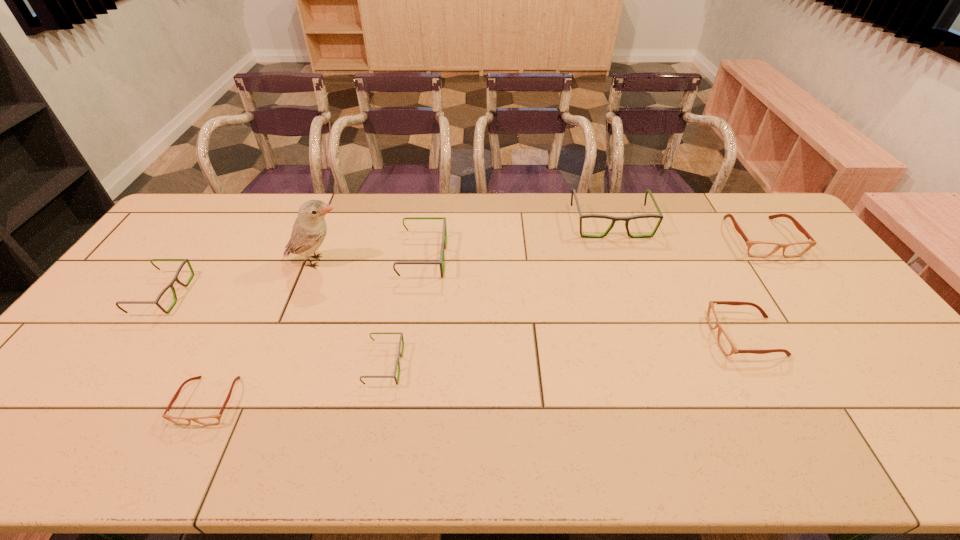
Select which brown spectacles appears as the third closest to the tallest spectacles. Please provide its 2D coordinates. Your answer should be formatted as a tuple, i.e. [(x, y)], where the tuple contains the x and y coordinates of a point satisfying the conditions above.

[(213, 419)]

Find the location of a particular element. This screenshot has height=540, width=960. brown spectacles that stands as the second closest to the sixth object from left to right is located at coordinates (726, 345).

Where is `vacant space that satisfies the following two spatial constraints: 1. on the lens of the third smallest black spectacles; 2. on the front-facing side of the shortest spectacles`? This screenshot has height=540, width=960. vacant space that satisfies the following two spatial constraints: 1. on the lens of the third smallest black spectacles; 2. on the front-facing side of the shortest spectacles is located at coordinates (402, 401).

You are a GUI agent. You are given a task and a screenshot of the screen. Output one action in this format:
    pyautogui.click(x=<x>, y=<y>)
    Task: Click on the vacant space that satisfies the following two spatial constraints: 1. on the front-facing side of the biggest brown spectacles; 2. on the lens of the smallest black spectacles
    The image size is (960, 540).
    Given the screenshot: What is the action you would take?
    pyautogui.click(x=852, y=364)

Identify the location of free space that satisfies the following two spatial constraints: 1. on the front-facing side of the farthest brown spectacles; 2. on the lens of the smallest black spectacles. This screenshot has height=540, width=960. (852, 364).

Identify the location of vacant area in the image that satisfies the following two spatial constraints: 1. on the lens of the second tallest object; 2. on the lens of the second biggest black spectacles. (623, 257).

What are the coordinates of `vacant area in the image that satisfies the following two spatial constraints: 1. on the front-facing side of the farthest brown spectacles; 2. on the lens of the third biggest black spectacles` in the screenshot? It's located at (801, 294).

Image resolution: width=960 pixels, height=540 pixels. Identify the location of free spot that satisfies the following two spatial constraints: 1. on the front-facing side of the second object from right to left; 2. on the front-facing side of the smallest brown spectacles. (780, 401).

What are the coordinates of `vacant area in the image that satisfies the following two spatial constraints: 1. on the front-facing side of the rightmost spectacles; 2. on the lens of the leftmost object` in the screenshot? It's located at (801, 294).